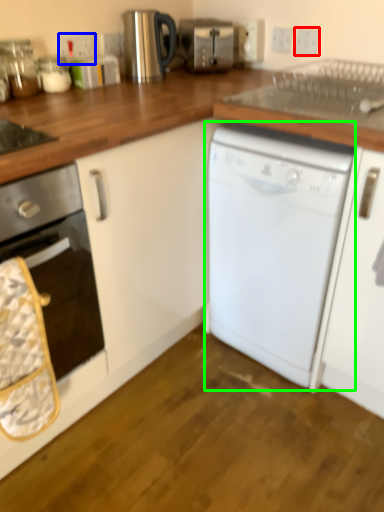
Question: Considering the real-world distances, which object is closest to electric outlet (highlighted by a red box)? electric outlet (highlighted by a blue box) or dishwasher (highlighted by a green box).

Choices:
 (A) electric outlet
 (B) dishwasher

Answer: (A)